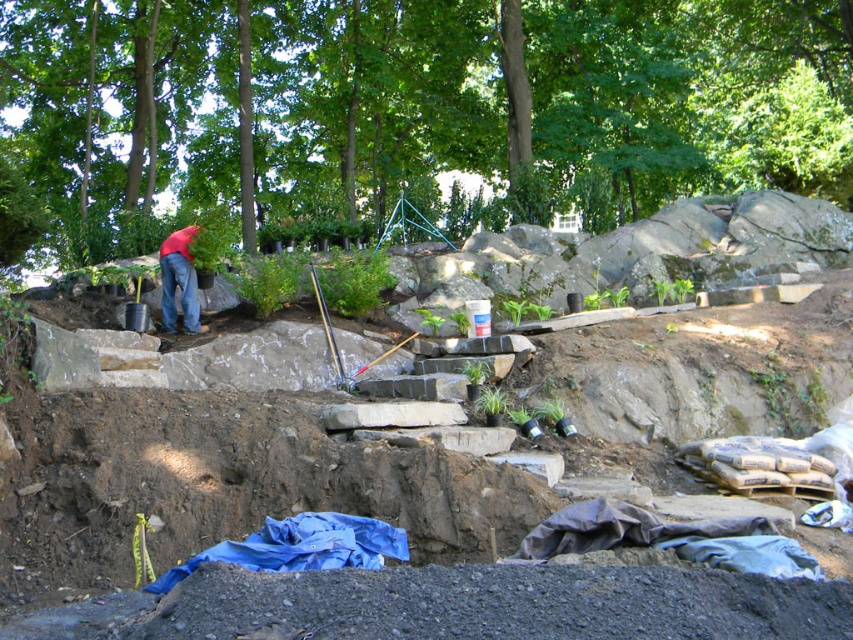
Image resolution: width=853 pixels, height=640 pixels. Describe the element at coordinates (225, 484) in the screenshot. I see `natural stone steps at upper center` at that location.

Is point (463, 472) closer to camera compared to point (163, 285)?

That is True.

This screenshot has width=853, height=640. I want to click on natural stone steps at upper center, so (x=225, y=484).